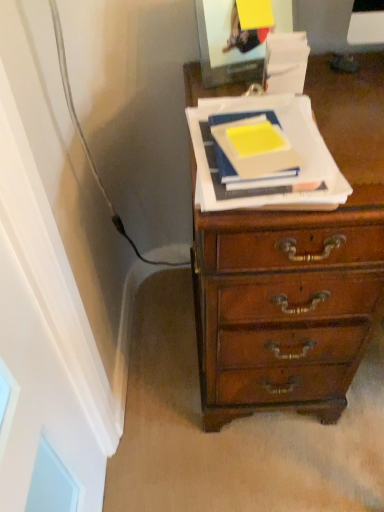
The height and width of the screenshot is (512, 384). Describe the element at coordinates (252, 148) in the screenshot. I see `yellow matte paper at center, the 2th paperback book from the right` at that location.

The image size is (384, 512). In order to click on yellow matte paper at center, the 2th paperback book from the right in this screenshot , I will do `click(252, 148)`.

Find the location of `yellow matte paper at center, the second paperback book in the left-to-right sequence`. yellow matte paper at center, the second paperback book in the left-to-right sequence is located at coordinates (291, 143).

The height and width of the screenshot is (512, 384). Describe the element at coordinates (291, 143) in the screenshot. I see `yellow matte paper at center, placed as the first paperback book when sorted from right to left` at that location.

Measure the distance between point (247, 196) and camera.

The distance of point (247, 196) from camera is 24.06 inches.

At what (x,y) coordinates should I click in order to perform the action: click on yellow matte paper at center, which appears as the first paperback book when viewed from the left. Please return your answer as a coordinate pair (x, y). The image size is (384, 512). Looking at the image, I should click on (252, 148).

Considering the relative positions of yellow matte paper at center, which appears as the first paperback book when viewed from the left, and yellow matte paper at center, the second paperback book in the left-to-right sequence, in the image provided, is yellow matte paper at center, which appears as the first paperback book when viewed from the left, to the left or to the right of yellow matte paper at center, the second paperback book in the left-to-right sequence,?

yellow matte paper at center, which appears as the first paperback book when viewed from the left, is positioned on yellow matte paper at center, the second paperback book in the left-to-right sequence,'s left side.

Which object is closer to the camera taking this photo, yellow matte paper at center, the 2th paperback book from the right, or yellow matte paper at center, placed as the first paperback book when sorted from right to left?

Positioned in front is yellow matte paper at center, placed as the first paperback book when sorted from right to left.

Is point (247, 164) in front of point (301, 125)?

That is True.

From the image's perspective, would you say yellow matte paper at center, which appears as the first paperback book when viewed from the left, is positioned over yellow matte paper at center, the second paperback book in the left-to-right sequence?

Yes, from the image's perspective, yellow matte paper at center, which appears as the first paperback book when viewed from the left, is on top of yellow matte paper at center, the second paperback book in the left-to-right sequence.

From a real-world perspective, between yellow matte paper at center, which appears as the first paperback book when viewed from the left, and yellow matte paper at center, placed as the first paperback book when sorted from right to left, who is vertically lower?

yellow matte paper at center, placed as the first paperback book when sorted from right to left, from a real-world perspective.

Is yellow matte paper at center, the 2th paperback book from the right, wider than yellow matte paper at center, placed as the first paperback book when sorted from right to left?

Incorrect, the width of yellow matte paper at center, the 2th paperback book from the right, does not surpass that of yellow matte paper at center, placed as the first paperback book when sorted from right to left.

Which of these two, yellow matte paper at center, the 2th paperback book from the right, or yellow matte paper at center, the second paperback book in the left-to-right sequence, stands taller?

yellow matte paper at center, the 2th paperback book from the right, is taller.

Considering the relative sizes of yellow matte paper at center, the 2th paperback book from the right, and yellow matte paper at center, placed as the first paperback book when sorted from right to left, in the image provided, is yellow matte paper at center, the 2th paperback book from the right, smaller than yellow matte paper at center, placed as the first paperback book when sorted from right to left,?

Yes.

Is yellow matte paper at center, which appears as the first paperback book when viewed from the left, not within yellow matte paper at center, the second paperback book in the left-to-right sequence?

Actually, yellow matte paper at center, which appears as the first paperback book when viewed from the left, is within yellow matte paper at center, the second paperback book in the left-to-right sequence.

Looking at this image, is there a large distance between yellow matte paper at center, which appears as the first paperback book when viewed from the left, and yellow matte paper at center, placed as the first paperback book when sorted from right to left?

No.

Is yellow matte paper at center, which appears as the first paperback book when viewed from the left, turned away from yellow matte paper at center, the second paperback book in the left-to-right sequence?

No, yellow matte paper at center, which appears as the first paperback book when viewed from the left,'s orientation is not away from yellow matte paper at center, the second paperback book in the left-to-right sequence.

Locate an element on the screen. The height and width of the screenshot is (512, 384). paperback book behind the yellow matte paper at center, placed as the first paperback book when sorted from right to left is located at coordinates (252, 148).

Between yellow matte paper at center, the second paperback book in the left-to-right sequence, and yellow matte paper at center, the 2th paperback book from the right, which one appears on the left side from the viewer's perspective?

yellow matte paper at center, the 2th paperback book from the right, is more to the left.

In the image, is yellow matte paper at center, the second paperback book in the left-to-right sequence, positioned in front of or behind yellow matte paper at center, which appears as the first paperback book when viewed from the left?

yellow matte paper at center, the second paperback book in the left-to-right sequence, is positioned closer to the viewer than yellow matte paper at center, which appears as the first paperback book when viewed from the left.

Which point is more forward, (286,111) or (274,160)?

Point (274,160)

From the image's perspective, is yellow matte paper at center, placed as the first paperback book when sorted from right to left, below yellow matte paper at center, the 2th paperback book from the right?

Yes.

From a real-world perspective, which is physically above, yellow matte paper at center, the second paperback book in the left-to-right sequence, or yellow matte paper at center, which appears as the first paperback book when viewed from the left?

yellow matte paper at center, which appears as the first paperback book when viewed from the left.

In terms of width, does yellow matte paper at center, the second paperback book in the left-to-right sequence, look wider or thinner when compared to yellow matte paper at center, which appears as the first paperback book when viewed from the left?

Clearly, yellow matte paper at center, the second paperback book in the left-to-right sequence, has more width compared to yellow matte paper at center, which appears as the first paperback book when viewed from the left.

From their relative heights in the image, would you say yellow matte paper at center, placed as the first paperback book when sorted from right to left, is taller or shorter than yellow matte paper at center, which appears as the first paperback book when viewed from the left?

Considering their sizes, yellow matte paper at center, placed as the first paperback book when sorted from right to left, has less height than yellow matte paper at center, which appears as the first paperback book when viewed from the left.

Can you confirm if yellow matte paper at center, placed as the first paperback book when sorted from right to left, is smaller than yellow matte paper at center, the 2th paperback book from the right?

No, yellow matte paper at center, placed as the first paperback book when sorted from right to left, is not smaller than yellow matte paper at center, the 2th paperback book from the right.

Is yellow matte paper at center, placed as the first paperback book when sorted from right to left, not within yellow matte paper at center, which appears as the first paperback book when viewed from the left?

Yes.

Is yellow matte paper at center, the second paperback book in the left-to-right sequence, placed right next to yellow matte paper at center, which appears as the first paperback book when viewed from the left?

Yes, yellow matte paper at center, the second paperback book in the left-to-right sequence, and yellow matte paper at center, which appears as the first paperback book when viewed from the left, clearly make contact.

Is yellow matte paper at center, placed as the first paperback book when sorted from right to left, looking in the opposite direction of yellow matte paper at center, which appears as the first paperback book when viewed from the left?

No, yellow matte paper at center, placed as the first paperback book when sorted from right to left, is not facing the opposite direction of yellow matte paper at center, which appears as the first paperback book when viewed from the left.

How many degrees apart are the facing directions of yellow matte paper at center, placed as the first paperback book when sorted from right to left, and yellow matte paper at center, which appears as the first paperback book when viewed from the left?

yellow matte paper at center, placed as the first paperback book when sorted from right to left, and yellow matte paper at center, which appears as the first paperback book when viewed from the left, are facing 2.02 degrees away from each other.

Identify the location of paperback book located on the left of yellow matte paper at center, the second paperback book in the left-to-right sequence. Image resolution: width=384 pixels, height=512 pixels. (252, 148).

The width and height of the screenshot is (384, 512). Find the location of `paperback book on the right of yellow matte paper at center, which appears as the first paperback book when viewed from the left`. paperback book on the right of yellow matte paper at center, which appears as the first paperback book when viewed from the left is located at coordinates (291, 143).

Find the location of a particular element. The height and width of the screenshot is (512, 384). paperback book below the yellow matte paper at center, which appears as the first paperback book when viewed from the left (from the image's perspective) is located at coordinates (291, 143).